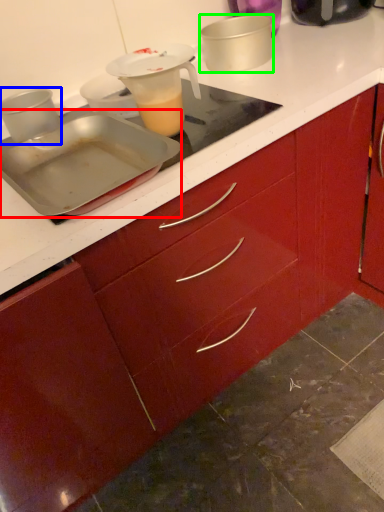
Question: Which object is positioned closest to kitchen appliance (highlighted by a red box)? Select from kitchen appliance (highlighted by a blue box) and kitchen appliance (highlighted by a green box).

Choices:
 (A) kitchen appliance
 (B) kitchen appliance

Answer: (A)